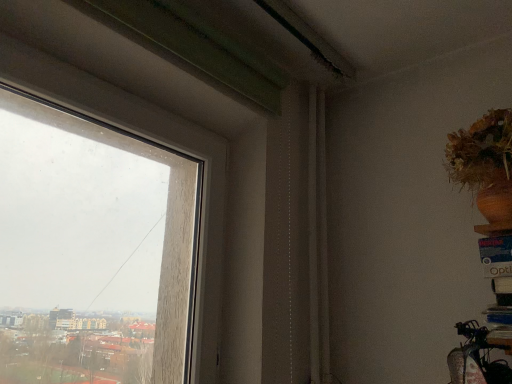
This screenshot has width=512, height=384. Describe the element at coordinates (499, 286) in the screenshot. I see `white cardboard box at right` at that location.

You are a GUI agent. You are given a task and a screenshot of the screen. Output one action in this format:
    pyautogui.click(x=<x>, y=<y>)
    Task: Click on the white cardboard box at right
    
    Given the screenshot: What is the action you would take?
    pos(499,286)

This screenshot has height=384, width=512. I want to click on white cardboard box at right, so click(x=499, y=286).